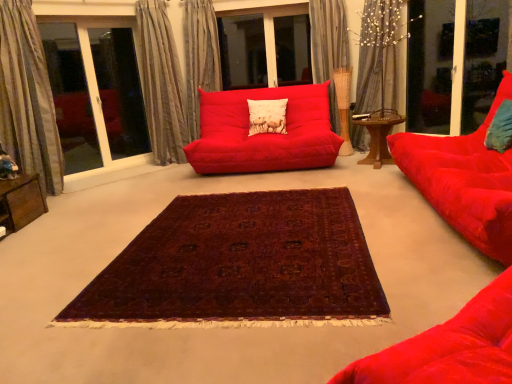
The height and width of the screenshot is (384, 512). What are the coordinates of `vacant area situated below deep burgundy woven rug at center (from a real-world perspective)` in the screenshot? It's located at (248, 233).